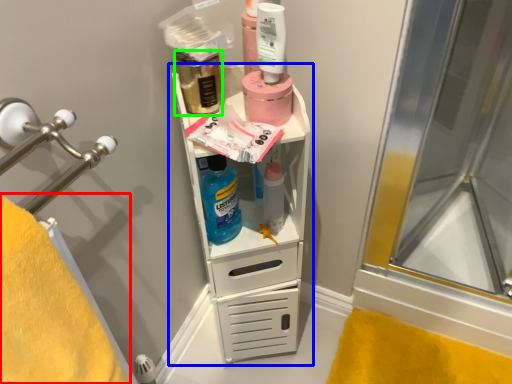
Question: Considering the real-world distances, which object is farthest from bath towel (highlighted by a red box)? bathroom cabinet (highlighted by a blue box) or mouthwash (highlighted by a green box)?

Choices:
 (A) bathroom cabinet
 (B) mouthwash

Answer: (B)